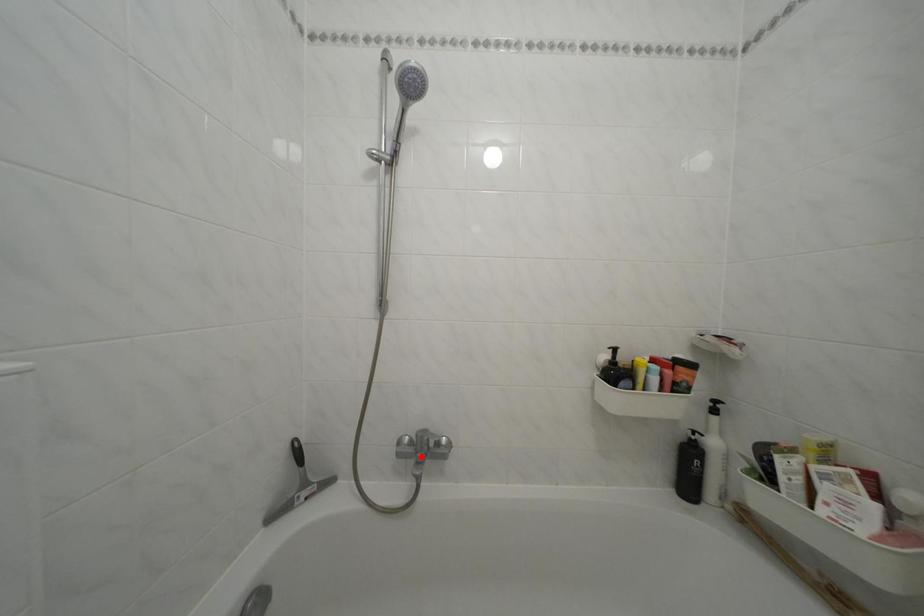
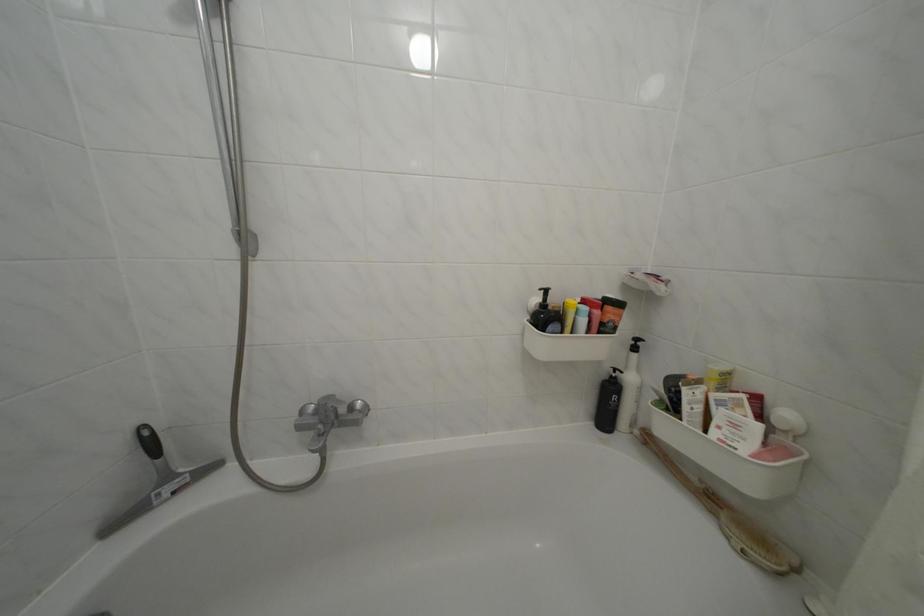
Locate, in the second image, the point that corresponds to the highlighted location in the first image.

(323, 426)